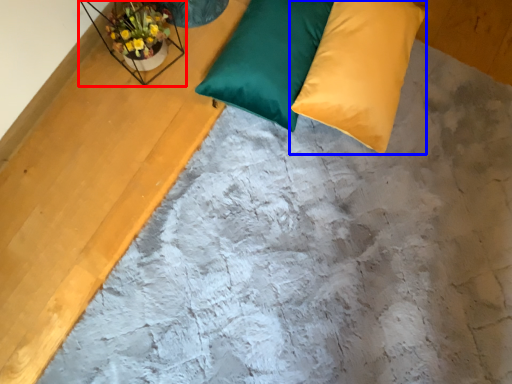
Question: Which object is further to the camera taking this photo, window sill (highlighted by a red box) or pillow (highlighted by a blue box)?

Choices:
 (A) window sill
 (B) pillow

Answer: (B)